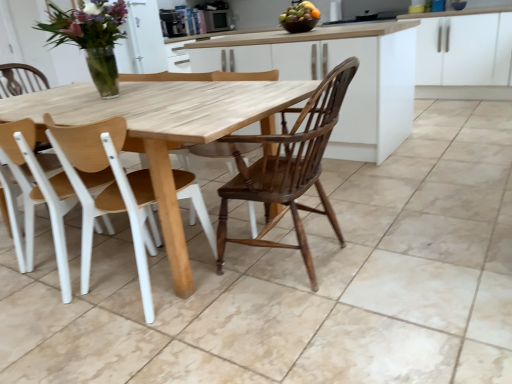
Question: Would you consider clear glass vase at upper left to be distant from white plastic chair at left, acting as the second chair starting from the right?

Choices:
 (A) no
 (B) yes

Answer: (A)

Question: From a real-world perspective, is clear glass vase at upper left over white plastic chair at left, acting as the second chair starting from the right?

Choices:
 (A) yes
 (B) no

Answer: (A)

Question: Is clear glass vase at upper left located outside white plastic chair at left, which is the first chair in left-to-right order?

Choices:
 (A) no
 (B) yes

Answer: (B)

Question: Is white plastic chair at left, which is the first chair in left-to-right order, inside clear glass vase at upper left?

Choices:
 (A) yes
 (B) no

Answer: (B)

Question: Is clear glass vase at upper left positioned behind white plastic chair at left, acting as the second chair starting from the right?

Choices:
 (A) no
 (B) yes

Answer: (B)

Question: Looking at the image, does clear glass vase at upper left seem bigger or smaller compared to matte black microwave at upper center?

Choices:
 (A) big
 (B) small

Answer: (A)

Question: Looking at their shapes, would you say clear glass vase at upper left is wider or thinner than matte black microwave at upper center?

Choices:
 (A) wide
 (B) thin

Answer: (A)

Question: Based on their positions, is clear glass vase at upper left located to the left or right of matte black microwave at upper center?

Choices:
 (A) left
 (B) right

Answer: (A)

Question: From the image's perspective, relative to matte black microwave at upper center, is clear glass vase at upper left above or below?

Choices:
 (A) below
 (B) above

Answer: (A)

Question: From a real-world perspective, is white plastic chair at left, which is the first chair in left-to-right order, positioned above or below clear glass vase at upper left?

Choices:
 (A) above
 (B) below

Answer: (B)

Question: Considering the positions of white plastic chair at left, acting as the second chair starting from the right, and clear glass vase at upper left in the image, is white plastic chair at left, acting as the second chair starting from the right, bigger or smaller than clear glass vase at upper left?

Choices:
 (A) big
 (B) small

Answer: (A)

Question: Is white plastic chair at left, acting as the second chair starting from the right, in front of or behind clear glass vase at upper left in the image?

Choices:
 (A) behind
 (B) front

Answer: (B)

Question: Visually, is white plastic chair at left, which is the first chair in left-to-right order, positioned to the left or to the right of clear glass vase at upper left?

Choices:
 (A) right
 (B) left

Answer: (B)

Question: From their relative heights in the image, would you say wooden at center, the 1th chair when ordered from right to left, is taller or shorter than white matte cabinet at upper right?

Choices:
 (A) tall
 (B) short

Answer: (B)

Question: Is wooden at center, the 2th chair viewed from the left, wider or thinner than white matte cabinet at upper right?

Choices:
 (A) thin
 (B) wide

Answer: (A)